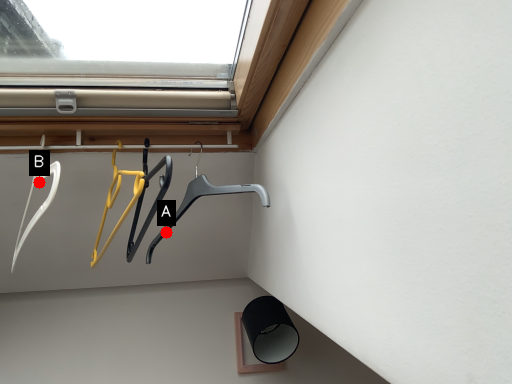
Question: Two points are circled on the image, labeled by A and B beside each circle. Which point appears closest to the camera in this image?

Choices:
 (A) A is closer
 (B) B is closer

Answer: (B)